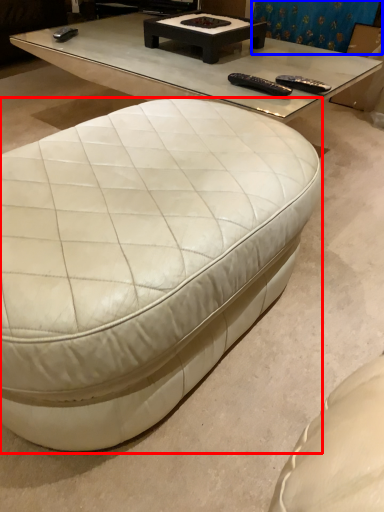
Question: Among these objects, which one is farthest to the camera, coffee table (highlighted by a red box) or curtain (highlighted by a blue box)?

Choices:
 (A) coffee table
 (B) curtain

Answer: (B)